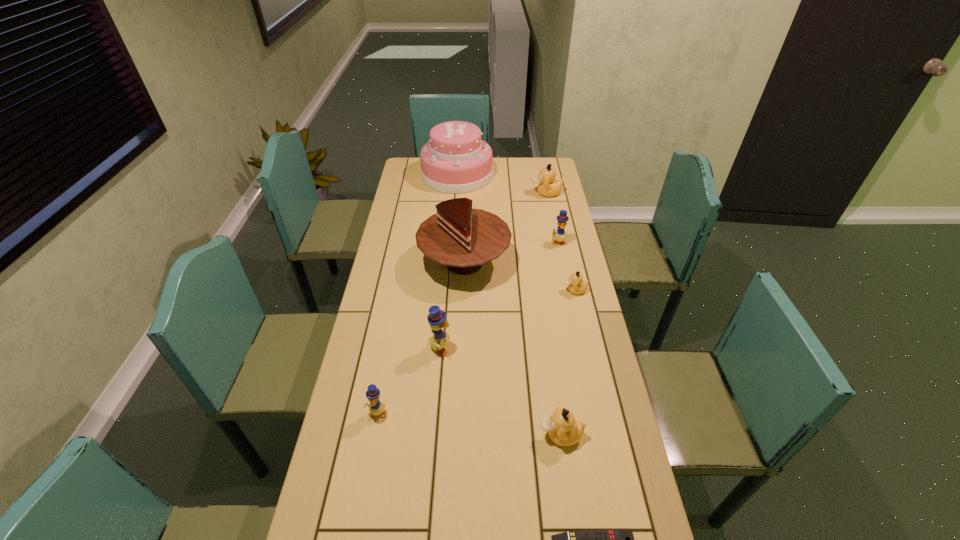
Identify the location of the smallest yellow duckling. This screenshot has width=960, height=540. (376, 407).

The height and width of the screenshot is (540, 960). I want to click on the leftmost yellow duckling, so click(376, 407).

The height and width of the screenshot is (540, 960). What are the coordinates of `the shortest duckling` in the screenshot? It's located at (576, 285).

Find the location of a particular element. This screenshot has width=960, height=540. the smallest tan duckling is located at coordinates (576, 285).

Find the location of a particular element. free space located on the right of the pink birthday cake is located at coordinates (554, 175).

The width and height of the screenshot is (960, 540). Identify the location of vacant space situated on the right of the red cake. (575, 262).

The height and width of the screenshot is (540, 960). I want to click on vacant area located on the face of the second yellow duckling from right to left, where the monocle is placed, so click(x=520, y=348).

This screenshot has height=540, width=960. I want to click on vacant space located 0.290m on the face of the biggest tan duckling, so click(468, 193).

This screenshot has height=540, width=960. Find the location of `vacant point located 0.160m on the face of the biggest tan duckling`. vacant point located 0.160m on the face of the biggest tan duckling is located at coordinates (496, 193).

Identify the location of vacant space situated on the face of the biggest tan duckling. The height and width of the screenshot is (540, 960). (496, 193).